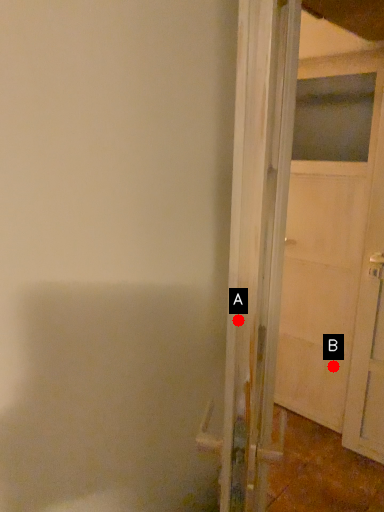
Question: Two points are circled on the image, labeled by A and B beside each circle. Which point is closer to the camera?

Choices:
 (A) A is closer
 (B) B is closer

Answer: (A)